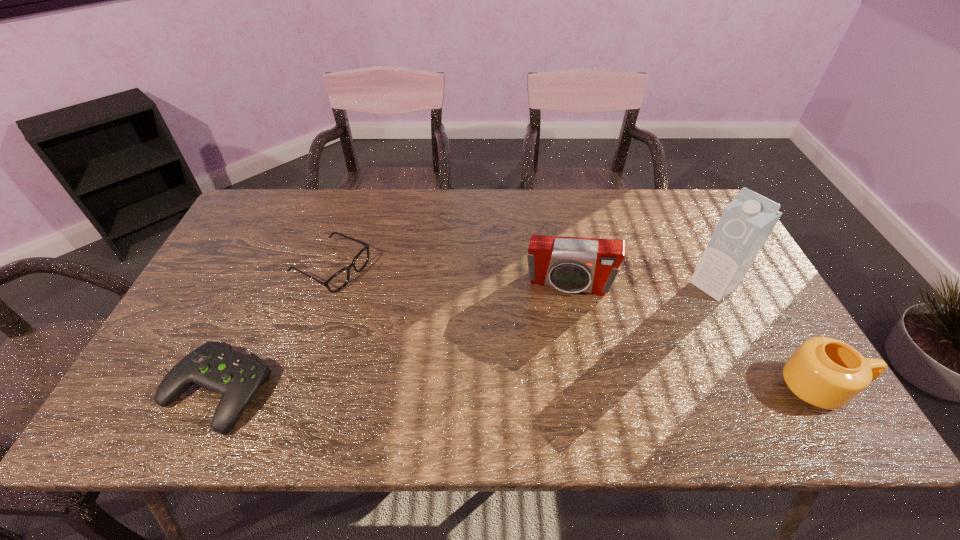
This screenshot has width=960, height=540. I want to click on blank space located 0.140m on the front-facing side of the camera, so click(x=554, y=340).

Image resolution: width=960 pixels, height=540 pixels. Find the location of `free space located 0.100m on the front-facing side of the camera`. free space located 0.100m on the front-facing side of the camera is located at coordinates (556, 328).

Where is `free space located on the front-facing side of the camera`? The height and width of the screenshot is (540, 960). free space located on the front-facing side of the camera is located at coordinates (552, 354).

This screenshot has height=540, width=960. What are the coordinates of `blank space located 0.160m on the front-facing side of the spectacles` in the screenshot? It's located at (407, 305).

The height and width of the screenshot is (540, 960). Find the location of `free space located on the front-facing side of the spectacles`. free space located on the front-facing side of the spectacles is located at coordinates click(x=390, y=296).

Where is `vacant space situated on the front-facing side of the spectacles`? The height and width of the screenshot is (540, 960). vacant space situated on the front-facing side of the spectacles is located at coordinates (432, 316).

Image resolution: width=960 pixels, height=540 pixels. What are the coordinates of `control at the near edge` in the screenshot? It's located at (215, 366).

At what (x,y) coordinates should I click in order to perform the action: click on mug that is positioned at the near edge. Please return your answer as a coordinate pair (x, y). The width and height of the screenshot is (960, 540). Looking at the image, I should click on (825, 372).

Where is `object present at the left edge`? Image resolution: width=960 pixels, height=540 pixels. object present at the left edge is located at coordinates (215, 366).

At what (x,y) coordinates should I click in order to perform the action: click on mug positioned at the right edge. Please return your answer as a coordinate pair (x, y). The height and width of the screenshot is (540, 960). Looking at the image, I should click on (825, 372).